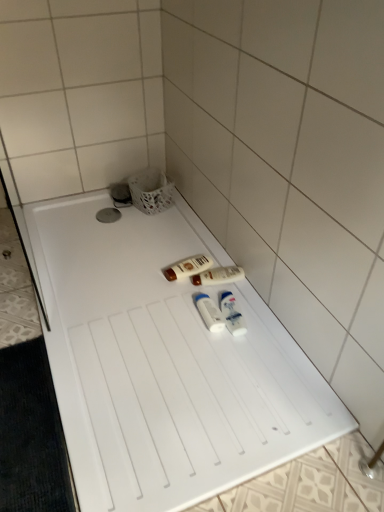
Question: Which direction should I rotate to look at white glossy lotion at center, acting as the second toiletry starting from the back?

Choices:
 (A) left
 (B) right

Answer: (B)

Question: From the image's perspective, is white plastic tubes at center, which is counted as the second toiletry, starting from the front, located above white plastic tray at center?

Choices:
 (A) no
 (B) yes

Answer: (A)

Question: From a real-world perspective, is white plastic tubes at center, which is counted as the second toiletry, starting from the front, located higher than white plastic tray at center?

Choices:
 (A) yes
 (B) no

Answer: (A)

Question: Does white plastic tubes at center, placed as the 3th toiletry when sorted from back to front, have a greater width compared to white plastic tray at center?

Choices:
 (A) yes
 (B) no

Answer: (B)

Question: Is white plastic tubes at center, which is counted as the second toiletry, starting from the front, bigger than white plastic tray at center?

Choices:
 (A) no
 (B) yes

Answer: (A)

Question: Is white plastic tubes at center, which is counted as the second toiletry, starting from the front, facing towards white plastic tray at center?

Choices:
 (A) yes
 (B) no

Answer: (B)

Question: Would you say white plastic tubes at center, placed as the 3th toiletry when sorted from back to front, contains white plastic tray at center?

Choices:
 (A) no
 (B) yes

Answer: (A)

Question: Considering the relative sizes of matte brown lotion at center, which is counted as the 4th toiletry, starting from the front, and white plastic tubes at center, which is counted as the second toiletry, starting from the front, in the image provided, is matte brown lotion at center, which is counted as the 4th toiletry, starting from the front, thinner than white plastic tubes at center, which is counted as the second toiletry, starting from the front,?

Choices:
 (A) yes
 (B) no

Answer: (B)

Question: Would you say white plastic tubes at center, which is counted as the second toiletry, starting from the front, is part of matte brown lotion at center, which is counted as the 4th toiletry, starting from the front,'s contents?

Choices:
 (A) yes
 (B) no

Answer: (B)

Question: From the image's perspective, is matte brown lotion at center, placed as the first toiletry when sorted from back to front, above white plastic tubes at center, placed as the 3th toiletry when sorted from back to front?

Choices:
 (A) no
 (B) yes

Answer: (B)

Question: Does matte brown lotion at center, which is counted as the 4th toiletry, starting from the front, have a smaller size compared to white plastic tubes at center, placed as the 3th toiletry when sorted from back to front?

Choices:
 (A) no
 (B) yes

Answer: (A)

Question: Is matte brown lotion at center, placed as the first toiletry when sorted from back to front, at the right side of white plastic tubes at center, placed as the 3th toiletry when sorted from back to front?

Choices:
 (A) yes
 (B) no

Answer: (B)

Question: From the image's perspective, is matte brown lotion at center, which is counted as the 4th toiletry, starting from the front, under white plastic tubes at center, placed as the 3th toiletry when sorted from back to front?

Choices:
 (A) no
 (B) yes

Answer: (A)

Question: Is matte brown lotion at center, placed as the first toiletry when sorted from back to front, at the right side of white plastic bottles at center, the fourth toiletry positioned from the back?

Choices:
 (A) yes
 (B) no

Answer: (B)